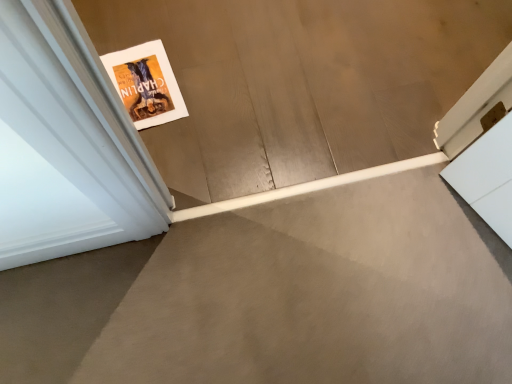
Identify the location of blank space situated above white matte book at lower left (from a real-world perspective). The width and height of the screenshot is (512, 384). (278, 63).